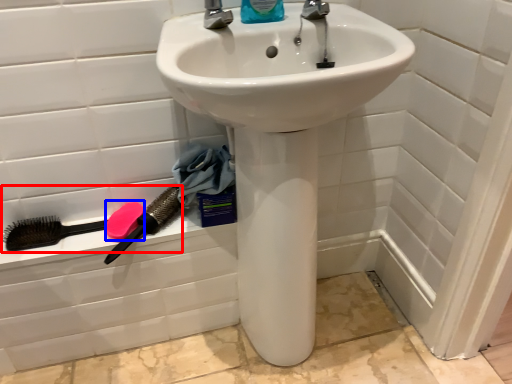
Question: Among these objects, which one is nearest to the camera, brush (highlighted by a red box) or soap (highlighted by a blue box)?

Choices:
 (A) brush
 (B) soap

Answer: (A)